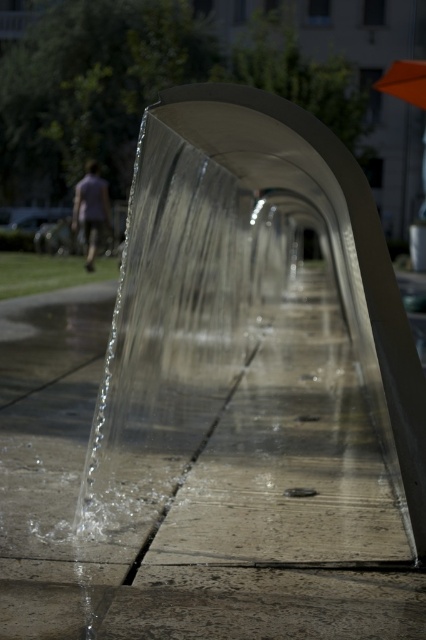
You are a photographer trying to capture both the light purple shirt at left and the orange fabric umbrella at upper right in the same frame. Since you want to ensure both are visible, which object should you focus on first to avoid blurring due to their size difference?

You should focus on the light purple shirt at left first because it is larger than the orange fabric umbrella at upper right, making it more likely to be in focus and less prone to motion blur if the camera settings are adjusted for its size.